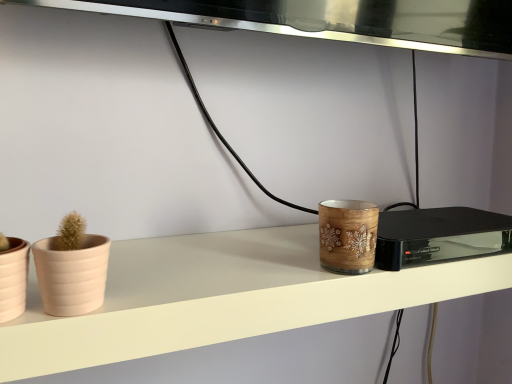
Question: Visually, is wooden candle holder at center positioned to the left or to the right of wooden candle holder at center?

Choices:
 (A) right
 (B) left

Answer: (B)

Question: Looking at their shapes, would you say wooden candle holder at center is wider or thinner than wooden candle holder at center?

Choices:
 (A) wide
 (B) thin

Answer: (A)

Question: Which object is positioned closest to the matte pink flowerpot at left, which is counted as the 1th flowerpot, starting from the left?

Choices:
 (A) beige matte flowerpot at left, positioned as the 2th flowerpot in left-to-right order
 (B) wooden candle holder at center
 (C) wooden candle holder at center
 (D) wooden candle holder at center

Answer: (A)

Question: Considering the real-world distances, which object is farthest from the beige matte flowerpot at left, positioned as the 2th flowerpot in left-to-right order?

Choices:
 (A) matte pink flowerpot at left, which is the second flowerpot in right-to-left order
 (B) wooden candle holder at center
 (C) wooden candle holder at center
 (D) wooden candle holder at center

Answer: (D)